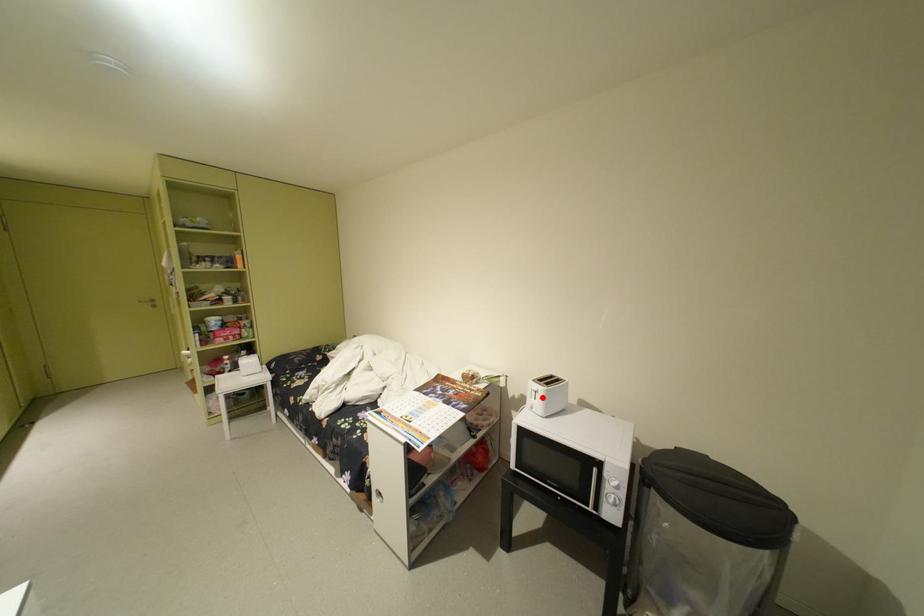
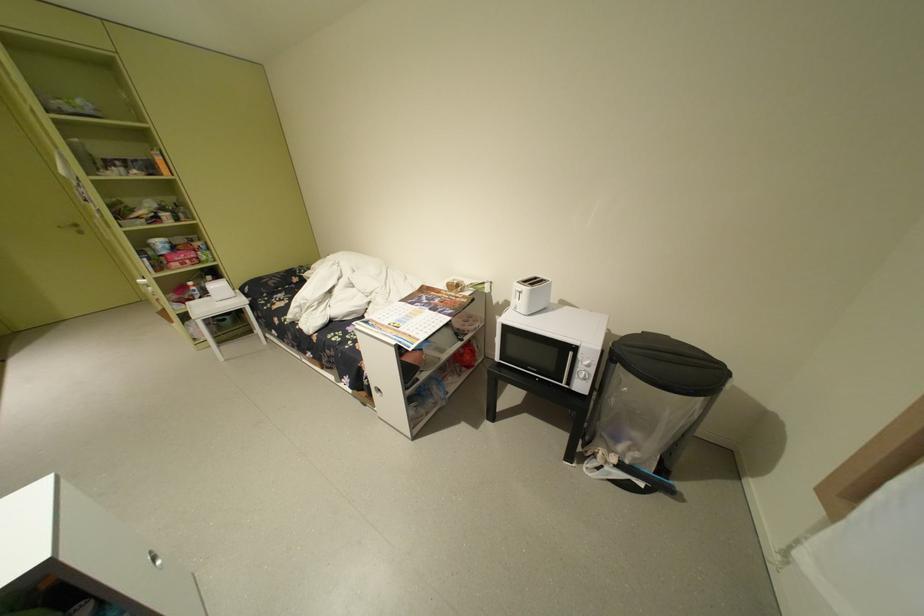
The point at the highlighted location is marked in the first image. Where is the corresponding point in the second image?

(527, 299)